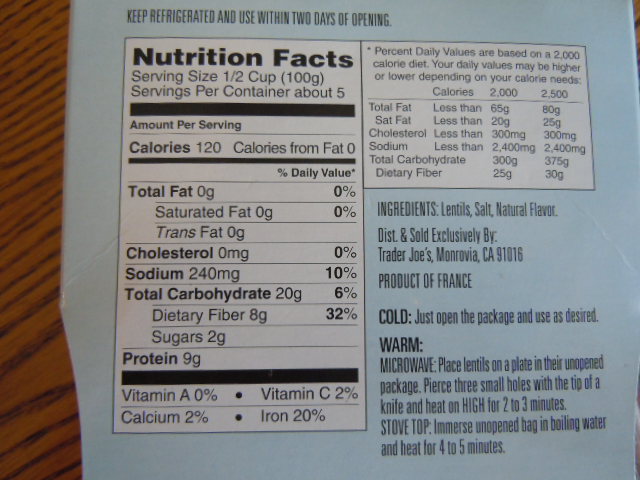
Identify the location of table. This screenshot has width=640, height=480. (41, 166), (35, 381).